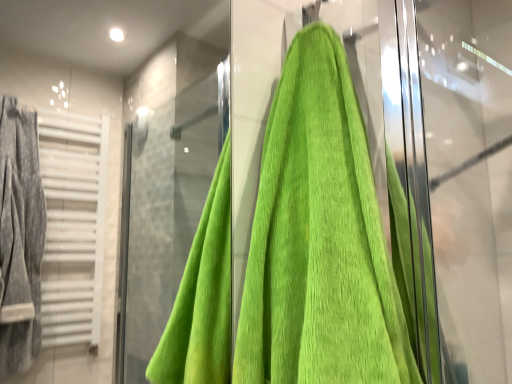
Describe the element at coordinates (470, 180) in the screenshot. I see `green towel at right` at that location.

Based on the photo, measure the distance between point (490,322) and camera.

Point (490,322) is 4.19 feet away from camera.

Where is `green towel at right`? green towel at right is located at coordinates (470, 180).

What do you see at coordinates (319, 239) in the screenshot? I see `green cotton towel at center` at bounding box center [319, 239].

Measure the distance between green cotton towel at center and camera.

green cotton towel at center and camera are 53.72 centimeters apart from each other.

Locate an element on the screen. green cotton towel at center is located at coordinates (319, 239).

The image size is (512, 384). I want to click on green towel at right, so click(x=470, y=180).

Which object is positioned more to the right, green towel at right or green cotton towel at center?

green towel at right is more to the right.

Is green towel at right behind green cotton towel at center?

Yes, green towel at right is further from the viewer.

Is point (502, 195) closer to camera compared to point (303, 241)?

No, (502, 195) is further to viewer.

From the image's perspective, is green towel at right beneath green cotton towel at center?

Incorrect, from the image's perspective, green towel at right is higher than green cotton towel at center.

From a real-world perspective, is green towel at right above or below green cotton towel at center?

green towel at right is above green cotton towel at center.

Does green towel at right have a greater width compared to green cotton towel at center?

Correct, the width of green towel at right exceeds that of green cotton towel at center.

In the scene shown: Who is taller, green towel at right or green cotton towel at center?

green towel at right is taller.

Consider the image. Considering the relative sizes of green towel at right and green cotton towel at center in the image provided, is green towel at right smaller than green cotton towel at center?

Actually, green towel at right might be larger than green cotton towel at center.

Can we say green towel at right lies outside green cotton towel at center?

green towel at right lies outside green cotton towel at center's area.

Would you say green towel at right is a long distance from green cotton towel at center?

They are positioned close to each other.

From the picture: Is green towel at right oriented towards green cotton towel at center?

No, green towel at right does not turn towards green cotton towel at center.

Can you tell me how much green towel at right and green cotton towel at center differ in facing direction?

The angular difference between green towel at right and green cotton towel at center is 2.16 degrees.

Find the location of a particular element. The width and height of the screenshot is (512, 384). screen door above the green cotton towel at center (from the image's perspective) is located at coordinates (470, 180).

Considering the positions of objects green cotton towel at center and green towel at right in the image provided, who is more to the right, green cotton towel at center or green towel at right?

From the viewer's perspective, green towel at right appears more on the right side.

Considering the relative positions of green cotton towel at center and green towel at right in the image provided, is green cotton towel at center behind green towel at right?

No, the depth of green cotton towel at center is less than that of green towel at right.

Which point is more distant from viewer, (320, 69) or (459, 38)?

Point (459, 38)

From the image's perspective, which is below, green cotton towel at center or green towel at right?

green cotton towel at center.

From a real-world perspective, is green cotton towel at center located beneath green towel at right?

Yes.

Which of these two, green cotton towel at center or green towel at right, is wider?

With larger width is green towel at right.

Does green cotton towel at center have a greater height compared to green towel at right?

Incorrect, the height of green cotton towel at center is not larger of that of green towel at right.

Considering the relative sizes of green cotton towel at center and green towel at right in the image provided, is green cotton towel at center smaller than green towel at right?

Yes.

Which is correct: green cotton towel at center is inside green towel at right, or outside of it?

green cotton towel at center is not enclosed by green towel at right.

Is green cotton towel at center beside green towel at right?

No.

Is green towel at right at the back of green cotton towel at center?

green cotton towel at center is not turned away from green towel at right.

What's the angular difference between green cotton towel at center and green towel at right's facing directions?

2.16 degrees separate the facing orientations of green cotton towel at center and green towel at right.

Locate an element on the screen. This screenshot has width=512, height=384. towel below the green towel at right (from a real-world perspective) is located at coordinates pyautogui.click(x=319, y=239).

Find the location of `screen door that appears behind the green cotton towel at center`. screen door that appears behind the green cotton towel at center is located at coordinates pos(470,180).

Where is `towel to the left of green towel at right`? This screenshot has width=512, height=384. towel to the left of green towel at right is located at coordinates [x=319, y=239].